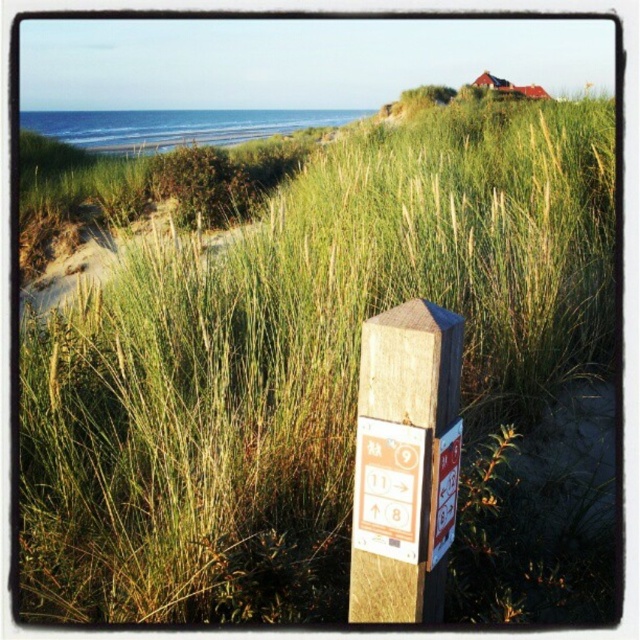
Question: Is orange paper sign at center above white plastic sign at center?

Choices:
 (A) yes
 (B) no

Answer: (B)

Question: Which object is the farthest from the white plastic sign at center?

Choices:
 (A) wooden post at center
 (B) orange paper sign at center

Answer: (A)

Question: Estimate the real-world distances between objects in this image. Which object is closer to the white plastic sign at center?

Choices:
 (A) orange paper sign at center
 (B) wooden post at center

Answer: (A)

Question: Which object is the farthest from the wooden post at center?

Choices:
 (A) orange paper sign at center
 (B) white plastic sign at center

Answer: (B)

Question: Is orange paper sign at center to the right of white plastic sign at center from the viewer's perspective?

Choices:
 (A) no
 (B) yes

Answer: (A)

Question: Does wooden post at center come behind orange paper sign at center?

Choices:
 (A) no
 (B) yes

Answer: (A)